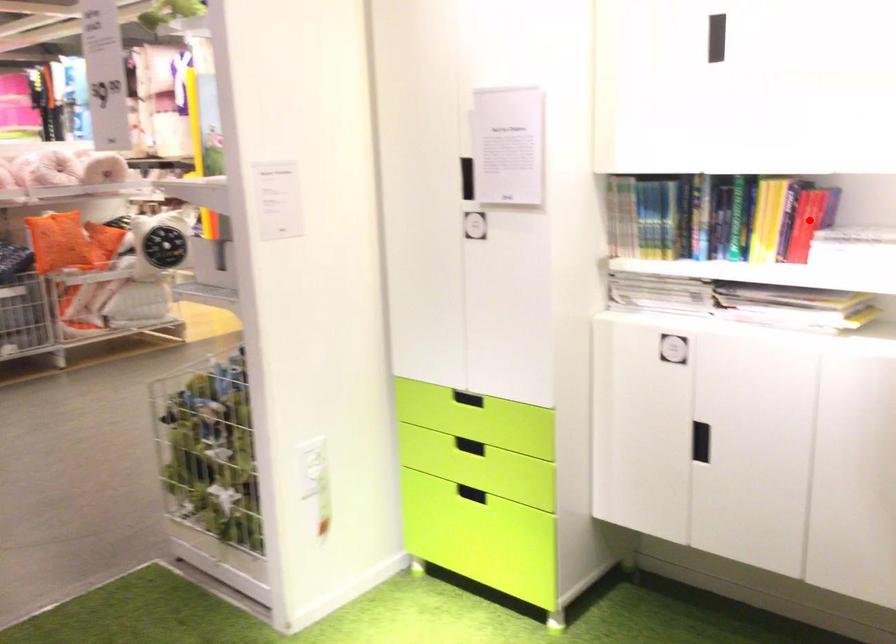
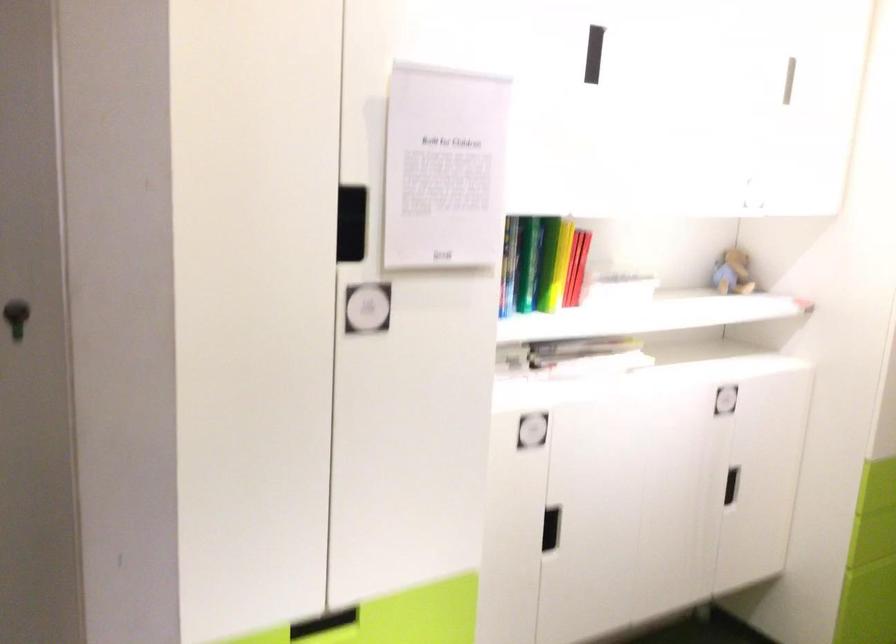
Where in the second image is the point corresponding to the highlighted location from the first image?

(576, 267)